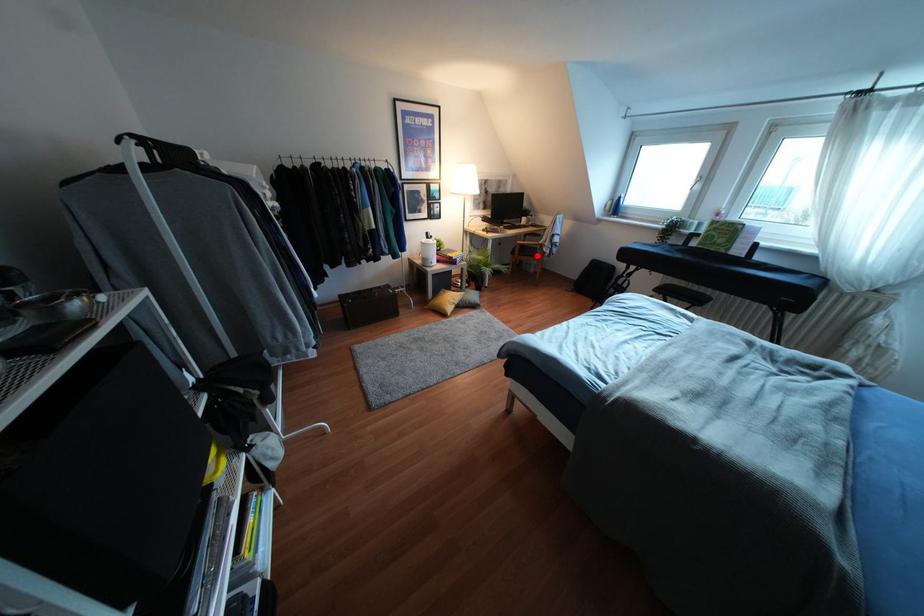
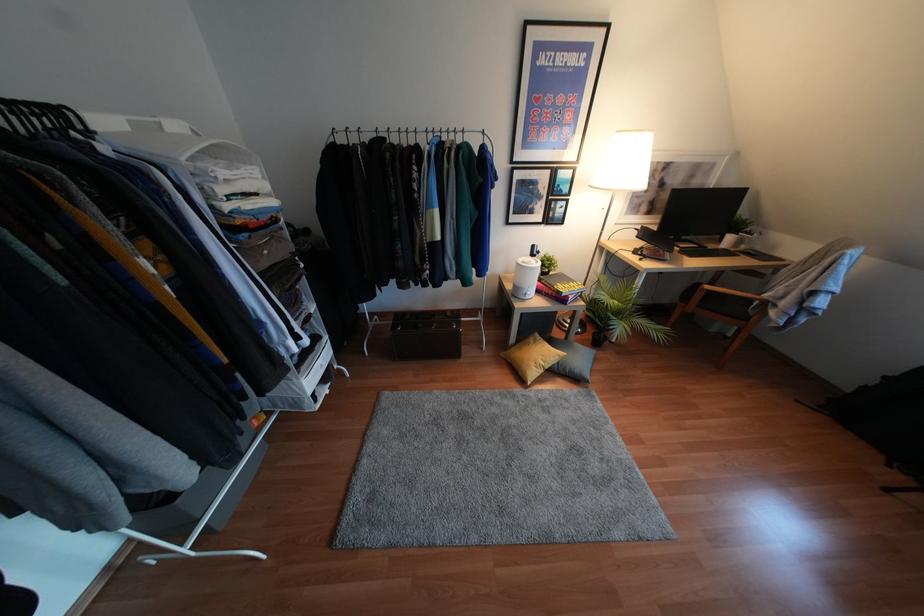
The point at the highlighted location is marked in the first image. Where is the corresponding point in the second image?

(745, 318)